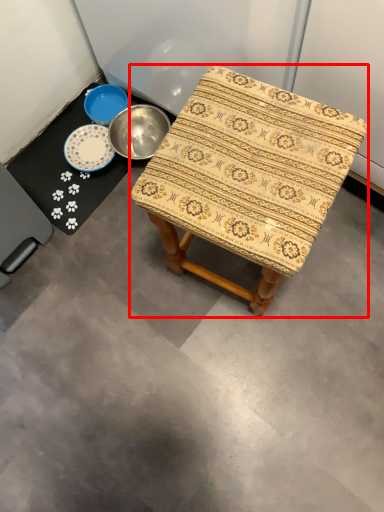
Question: From the image's perspective, considering the relative positions of stool (annotated by the red box) and round table in the image provided, where is stool (annotated by the red box) located with respect to the staircase?

Choices:
 (A) below
 (B) above

Answer: (A)